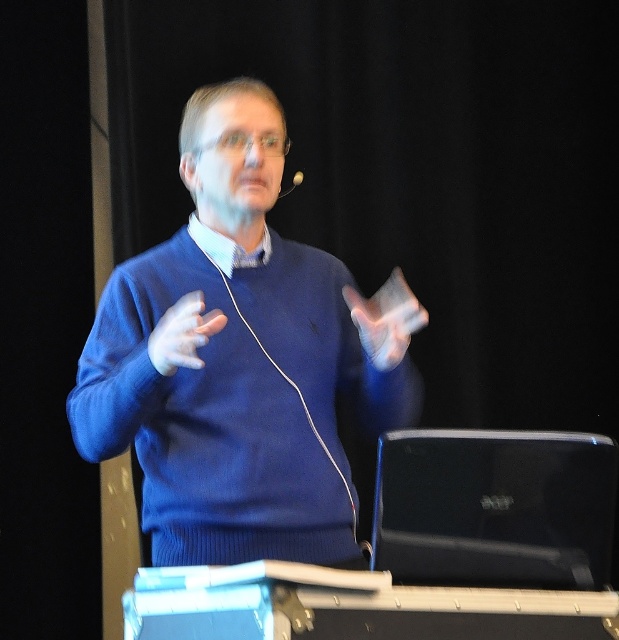
In the scene shown: Does matte blue sweater at center appear under silver metallic earphone at upper center?

Correct, matte blue sweater at center is located below silver metallic earphone at upper center.

Is the position of matte blue sweater at center less distant than that of silver metallic earphone at upper center?

Yes, matte blue sweater at center is in front of silver metallic earphone at upper center.

This screenshot has width=619, height=640. Find the location of `matte blue sweater at center`. matte blue sweater at center is located at coordinates (183, 333).

Between blue knitwear at center and silver metallic earphone at upper center, which one has less height?

Standing shorter between the two is silver metallic earphone at upper center.

At what (x,y) coordinates should I click in order to perform the action: click on blue knitwear at center. Please return your answer as a coordinate pair (x, y). Looking at the image, I should click on (240, 362).

Is point (284, 404) positioned before point (167, 324)?

No, it is not.

Does blue knitwear at center have a smaller size compared to matte blue sweater at center?

Incorrect, blue knitwear at center is not smaller in size than matte blue sweater at center.

Who is more distant from viewer, (x=233, y=120) or (x=188, y=316)?

Positioned behind is point (x=233, y=120).

This screenshot has width=619, height=640. Identify the location of blue knitwear at center. (240, 362).